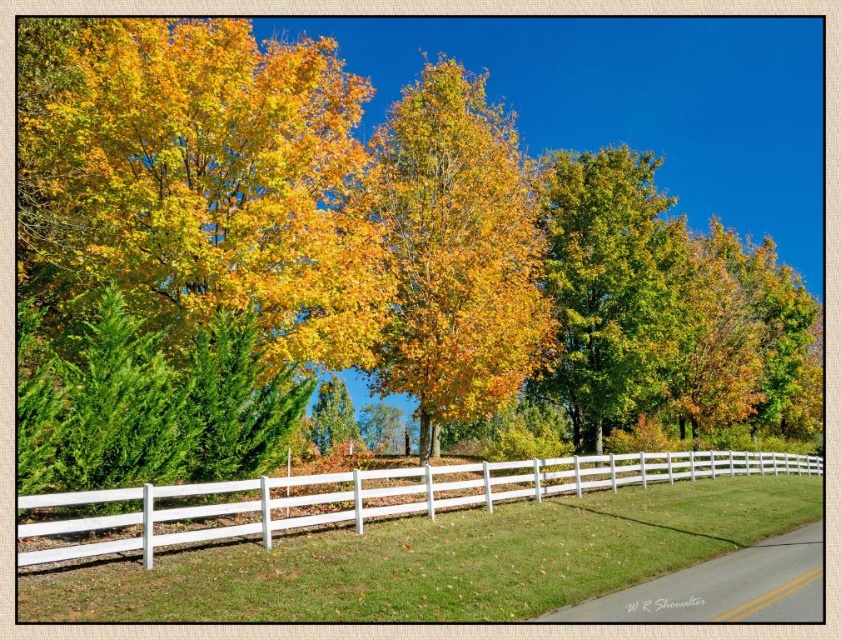
Is golden yellow leaves at center below white painted wood fence at lower center?

Actually, golden yellow leaves at center is above white painted wood fence at lower center.

I want to click on golden yellow leaves at center, so click(458, 253).

Find the location of `golden yellow leaves at center`. golden yellow leaves at center is located at coordinates (458, 253).

Image resolution: width=841 pixels, height=640 pixels. In order to click on golden yellow leaves at center in this screenshot , I will do [x=458, y=253].

Which is behind, point (435, 70) or point (574, 252)?

The point (574, 252) is behind.

Which is in front, point (477, 353) or point (611, 282)?

Positioned in front is point (477, 353).

Where is `golden yellow leaves at center`? The height and width of the screenshot is (640, 841). golden yellow leaves at center is located at coordinates (458, 253).

Is green matte tree at center taller than white painted wood fence at lower center?

Yes, green matte tree at center is taller than white painted wood fence at lower center.

How distant is green matte tree at center from white painted wood fence at lower center?

A distance of 7.55 meters exists between green matte tree at center and white painted wood fence at lower center.

Describe the element at coordinates (607, 288) in the screenshot. I see `green matte tree at center` at that location.

The width and height of the screenshot is (841, 640). What are the coordinates of `green matte tree at center` in the screenshot? It's located at (607, 288).